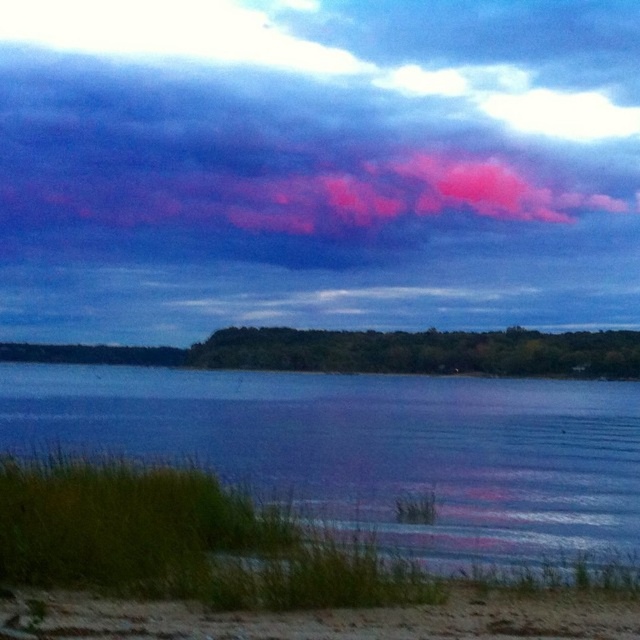
Question: Which point is farther from the camera taking this photo?

Choices:
 (A) (467, 614)
 (B) (16, 417)

Answer: (B)

Question: Does blue water at lower left have a smaller size compared to sandy at lower left?

Choices:
 (A) yes
 (B) no

Answer: (B)

Question: Can you confirm if blue water at lower left is smaller than sandy at lower left?

Choices:
 (A) yes
 (B) no

Answer: (B)

Question: Is blue water at lower left to the left of sandy at lower left from the viewer's perspective?

Choices:
 (A) yes
 (B) no

Answer: (B)

Question: Which of the following is the closest to the observer?

Choices:
 (A) (221, 435)
 (B) (502, 634)

Answer: (B)